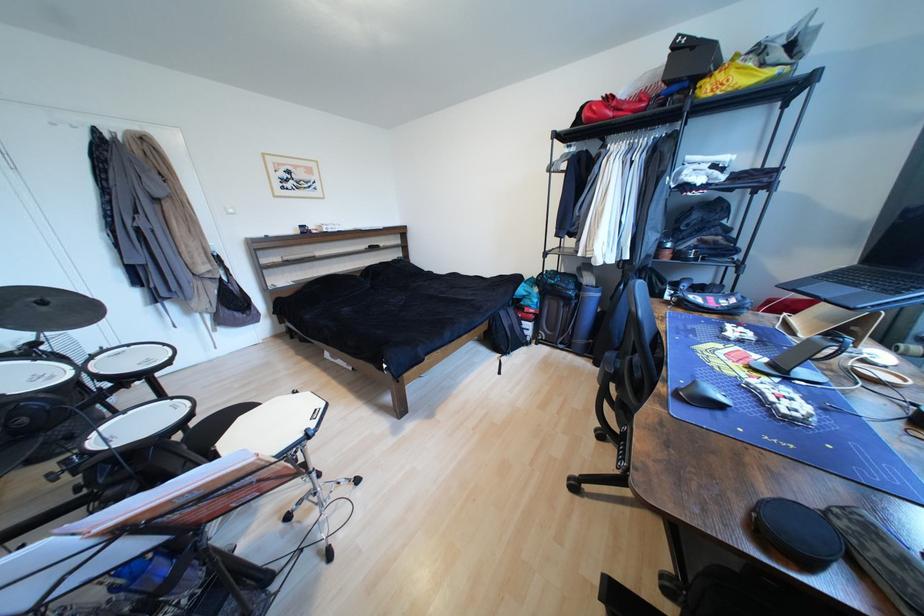
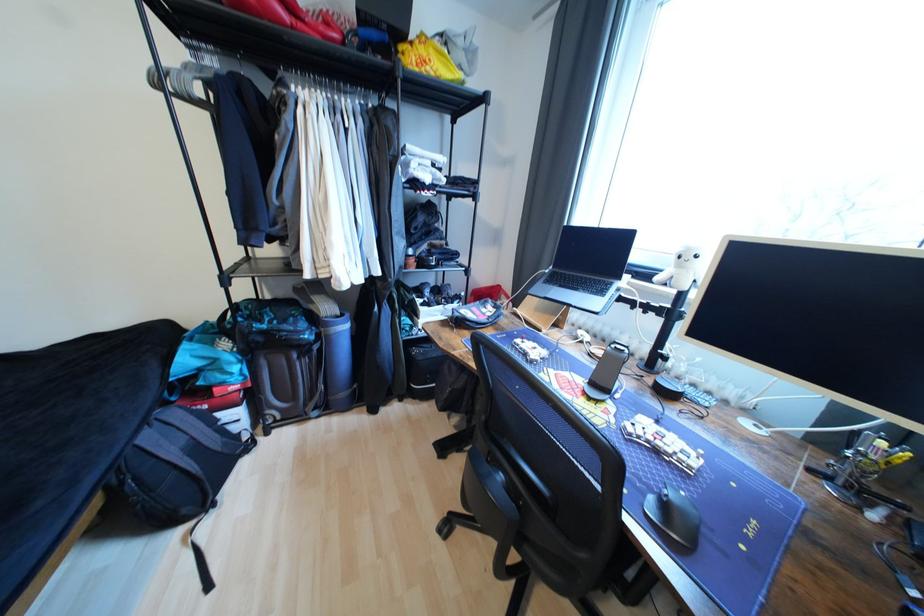
The point at (508,315) is marked in the first image. Where is the corresponding point in the second image?

(155, 439)